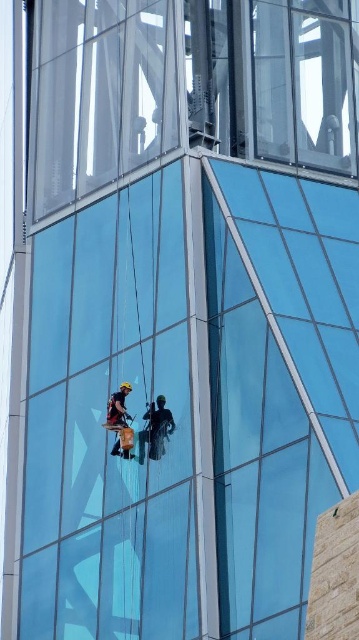
Question: Does transparent glass window at upper center appear on the left side of reddish-brown fabric harness at center?

Choices:
 (A) no
 (B) yes

Answer: (A)

Question: Does transparent glass window at upper center lie behind dark blue fabric at center?

Choices:
 (A) yes
 (B) no

Answer: (A)

Question: Which object is farther from the camera taking this photo?

Choices:
 (A) transparent glass window at upper center
 (B) dark blue fabric at center
 (C) reddish-brown fabric harness at center

Answer: (A)

Question: Does transparent glass window at upper center have a larger size compared to dark blue fabric at center?

Choices:
 (A) no
 (B) yes

Answer: (B)

Question: Estimate the real-world distances between objects in this image. Which object is farther from the transparent glass window at upper center?

Choices:
 (A) reddish-brown fabric harness at center
 (B) dark blue fabric at center

Answer: (B)

Question: Which point is farther to the camera?

Choices:
 (A) [127, 444]
 (B) [162, 442]

Answer: (A)